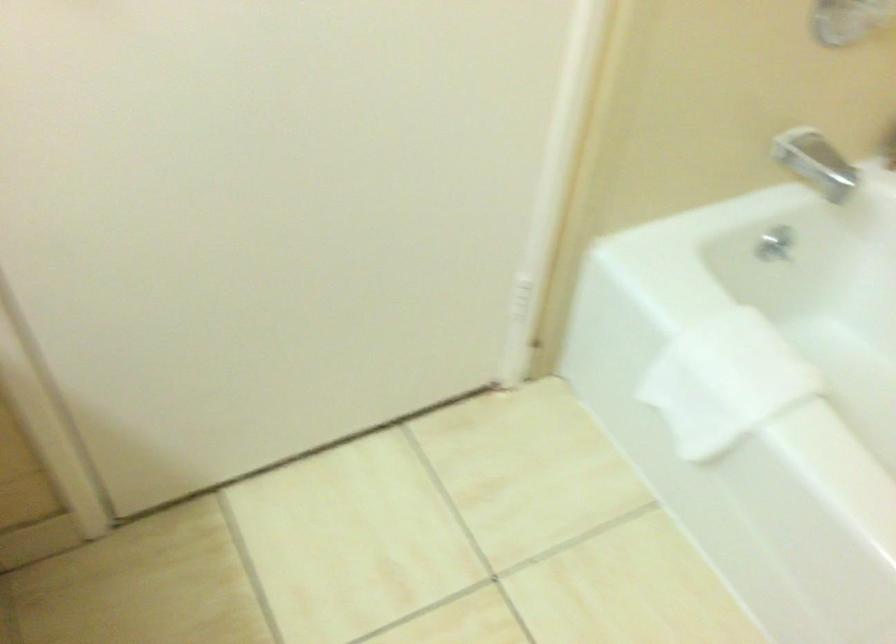
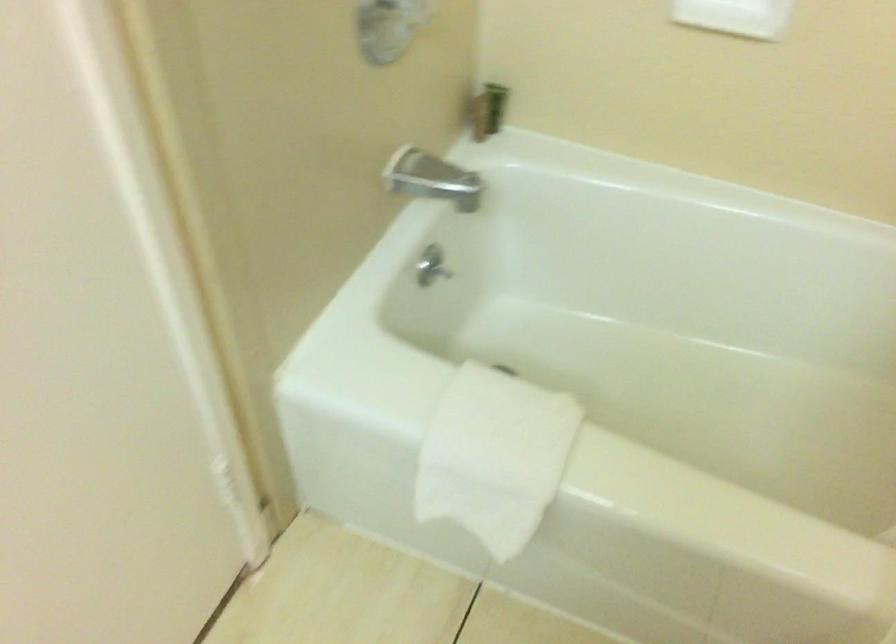
Find the pixel in the second image that matches the point at 724,370 in the first image.

(494, 456)